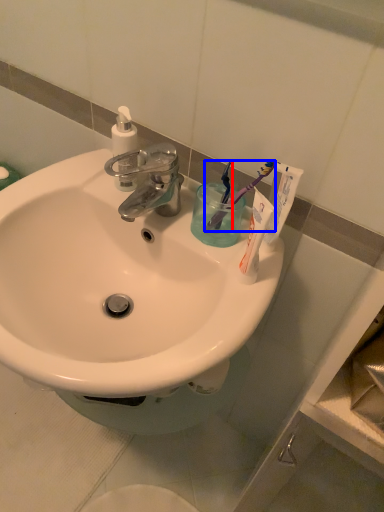
Question: Among these objects, which one is farthest to the camera, toothbrush (highlighted by a red box) or toothbrush (highlighted by a blue box)?

Choices:
 (A) toothbrush
 (B) toothbrush

Answer: (A)